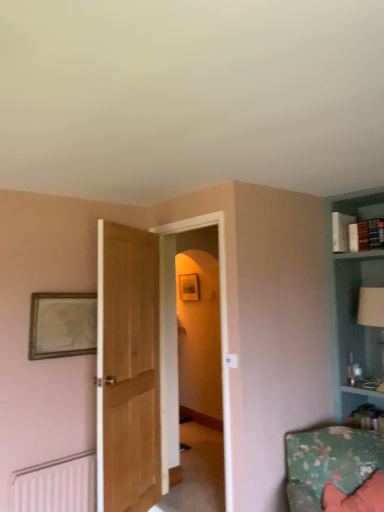
Question: Is transparent glass door at center not near light brown wood door at center?

Choices:
 (A) no
 (B) yes

Answer: (A)

Question: From a real-world perspective, is transparent glass door at center physically below light brown wood door at center?

Choices:
 (A) yes
 (B) no

Answer: (B)

Question: Is transparent glass door at center outside of light brown wood door at center?

Choices:
 (A) no
 (B) yes

Answer: (B)

Question: Considering the relative sizes of transparent glass door at center and light brown wood door at center in the image provided, is transparent glass door at center taller than light brown wood door at center?

Choices:
 (A) yes
 (B) no

Answer: (A)

Question: Does transparent glass door at center have a greater width compared to light brown wood door at center?

Choices:
 (A) no
 (B) yes

Answer: (B)

Question: Can you confirm if transparent glass door at center is positioned to the left of light brown wood door at center?

Choices:
 (A) yes
 (B) no

Answer: (B)

Question: Considering the relative sizes of light brown wood door at center and white matte radiator at lower left in the image provided, is light brown wood door at center taller than white matte radiator at lower left?

Choices:
 (A) no
 (B) yes

Answer: (B)

Question: Does light brown wood door at center touch white matte radiator at lower left?

Choices:
 (A) yes
 (B) no

Answer: (B)

Question: From a real-world perspective, is light brown wood door at center beneath white matte radiator at lower left?

Choices:
 (A) no
 (B) yes

Answer: (A)

Question: Can you confirm if light brown wood door at center is bigger than white matte radiator at lower left?

Choices:
 (A) yes
 (B) no

Answer: (A)

Question: Is light brown wood door at center to the left of white matte radiator at lower left from the viewer's perspective?

Choices:
 (A) no
 (B) yes

Answer: (A)

Question: Does light brown wood door at center have a greater width compared to white matte radiator at lower left?

Choices:
 (A) no
 (B) yes

Answer: (A)

Question: Is light brown wood door at center at the left side of wooden picture frame at upper left?

Choices:
 (A) yes
 (B) no

Answer: (B)